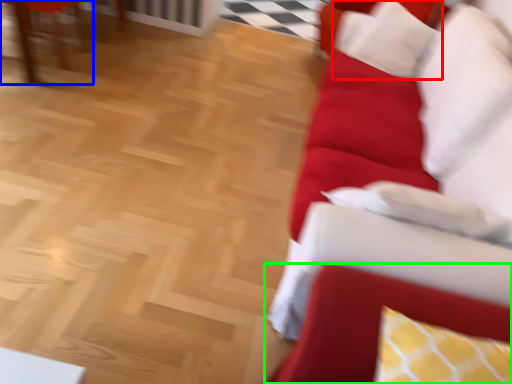
Question: Estimate the real-world distances between objects in this image. Which object is farther from pillow (highlighted by a red box), furniture (highlighted by a blue box) or swivel chair (highlighted by a green box)?

Choices:
 (A) furniture
 (B) swivel chair

Answer: (A)